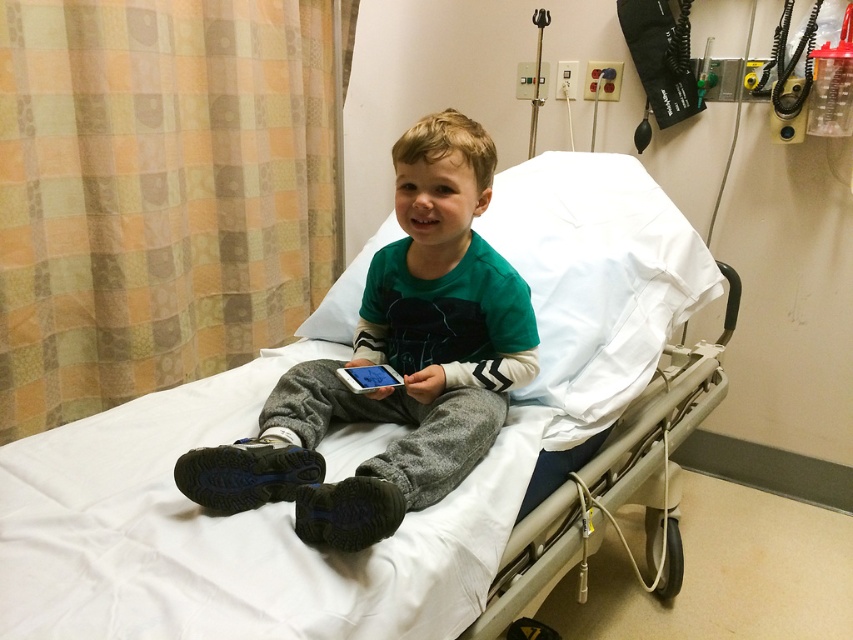
You are a nurse in a hospital room and need to place a medical device on one of two specific points on the wall. The points are located at coordinates point (416, 449) and point (399, 380). Which point is closer to you?

Point (416, 449) is closer to the viewer than point (399, 380), so the nurse should place the medical device there.

Based on the photo, you are a nurse entering the room and need to locate the green cotton shirt at center and the white fabric hospital bed at center. Based on their positions, which object is closer to the left side of the room?

The green cotton shirt at center is closer to the left side of the room since the white fabric hospital bed at center is positioned to its right.

You are a nurse in a hospital room. You need to place a small medical kit on the surface of the white fabric hospital bed at center so it can be easily accessed while the boy is using the white glossy phone at center. Will the medical kit fit on the bed?

The white fabric hospital bed at center has a larger size compared to the white glossy phone at center, so the medical kit should fit comfortably on the bed without any issues.